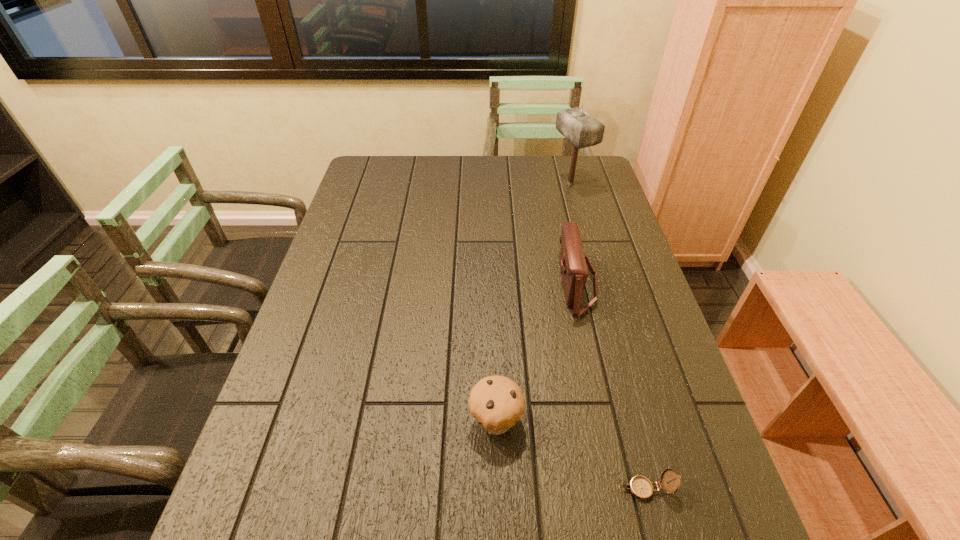
This screenshot has width=960, height=540. What are the coordinates of `mallet` in the screenshot? It's located at (583, 130).

The width and height of the screenshot is (960, 540). I want to click on the farthest object, so click(x=583, y=130).

You are a GUI agent. You are given a task and a screenshot of the screen. Output one action in this format:
    pyautogui.click(x=<x>, y=<y>)
    Task: Click on the third shortest object
    The image size is (960, 540).
    Given the screenshot: What is the action you would take?
    pyautogui.click(x=574, y=271)

The height and width of the screenshot is (540, 960). Find the location of `shoulder bag`. shoulder bag is located at coordinates (574, 271).

This screenshot has width=960, height=540. I want to click on the leftmost object, so click(x=496, y=402).

This screenshot has width=960, height=540. What are the coordinates of `muffin` in the screenshot? It's located at (496, 402).

Where is `compass`? Image resolution: width=960 pixels, height=540 pixels. compass is located at coordinates (640, 487).

The height and width of the screenshot is (540, 960). I want to click on the shortest object, so click(x=640, y=487).

Find the location of `vacant area located on the left of the tallest object`. vacant area located on the left of the tallest object is located at coordinates (488, 184).

Find the location of a particular element. This screenshot has width=960, height=540. free location located on the front flap of the second tallest object is located at coordinates (494, 283).